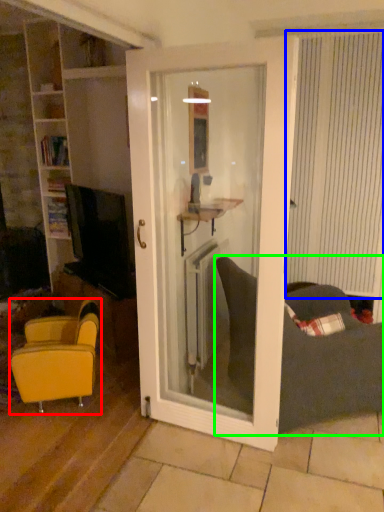
Question: Which object is the closest to the chair (highlighted by a red box)? Choose among these: curtain (highlighted by a blue box) or studio couch (highlighted by a green box).

Choices:
 (A) curtain
 (B) studio couch

Answer: (B)